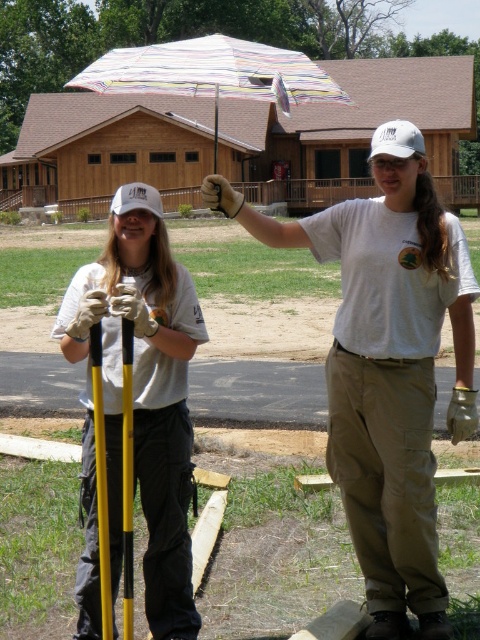
Looking at this image, you are a drone operator trying to capture a photo of the white cotton shirt at center. The drone has a camera with a 100mm focal length lens. If the shirt is at coordinates 0.591, 0.815, what is the best way to position the drone to ensure the shirt is centered in the photo?

The best way to position the drone is to align the camera directly above the white cotton shirt at center, which is located at coordinates (391,378). This ensures the shirt will be centered in the photo.

You are a photographer setting up for a group photo. You see a white cotton shirt at center and a white matte baseball cap at upper left. Which object should you focus on first if you want to capture both in the frame without moving the camera?

You should focus on the white cotton shirt at center first because it is positioned to the right of the white matte baseball cap at upper left, making it closer to the camera and easier to include in the frame without adjusting the camera position.